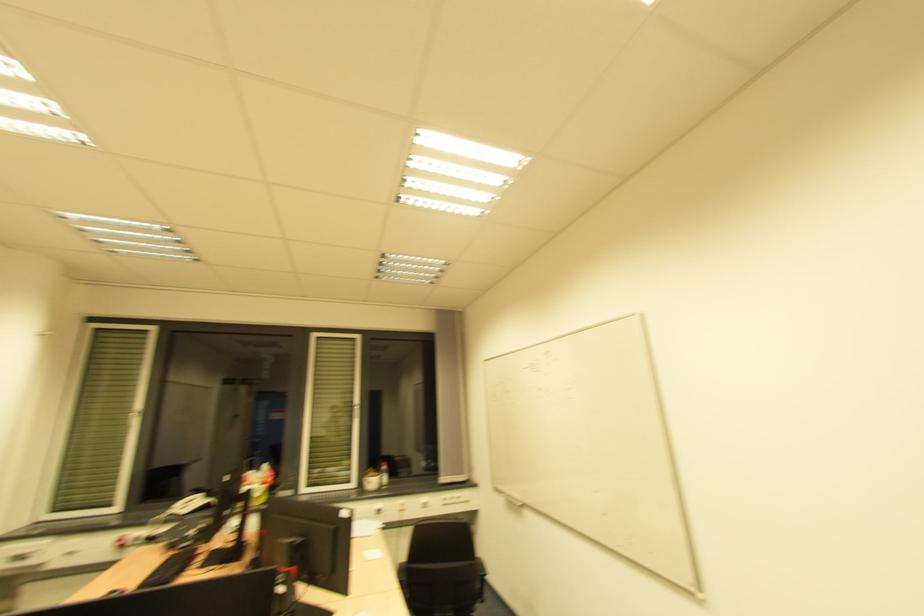
The width and height of the screenshot is (924, 616). What do you see at coordinates (433, 594) in the screenshot?
I see `a black chair sitting surface` at bounding box center [433, 594].